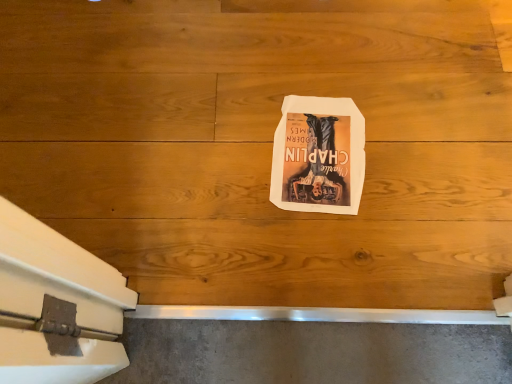
The height and width of the screenshot is (384, 512). I want to click on vacant space to the right of white paper at center, so click(x=408, y=137).